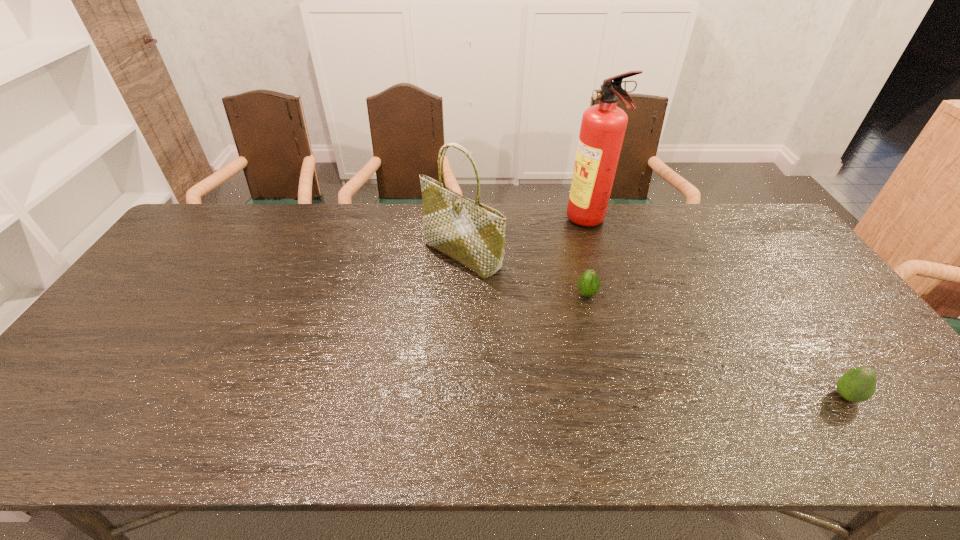
Identify the location of free location located 0.180m on the front of the shopping bag. The width and height of the screenshot is (960, 540). (459, 328).

At what (x,y) coordinates should I click in order to perform the action: click on vacant region located on the back of the nearer avocado. Please return your answer as a coordinate pair (x, y). Image resolution: width=960 pixels, height=540 pixels. Looking at the image, I should click on (803, 333).

Find the location of a particular element. Image resolution: width=960 pixels, height=540 pixels. vacant space located on the front of the farther avocado is located at coordinates (610, 387).

Where is `fire extinguisher at the far edge`? This screenshot has width=960, height=540. fire extinguisher at the far edge is located at coordinates (603, 126).

The width and height of the screenshot is (960, 540). I want to click on shopping bag that is positioned at the far edge, so click(473, 234).

Find the location of a particular element. This screenshot has height=540, width=960. object at the right edge is located at coordinates (858, 384).

The height and width of the screenshot is (540, 960). Identify the location of vacant space at the far edge of the desktop. (650, 229).

Where is `free region at the near edge of the desktop`? This screenshot has height=540, width=960. free region at the near edge of the desktop is located at coordinates (488, 451).

Locate an element on the screen. This screenshot has height=540, width=960. free point at the left edge is located at coordinates (147, 345).

Locate an element on the screen. The height and width of the screenshot is (540, 960). vacant space at the far left corner is located at coordinates (176, 238).